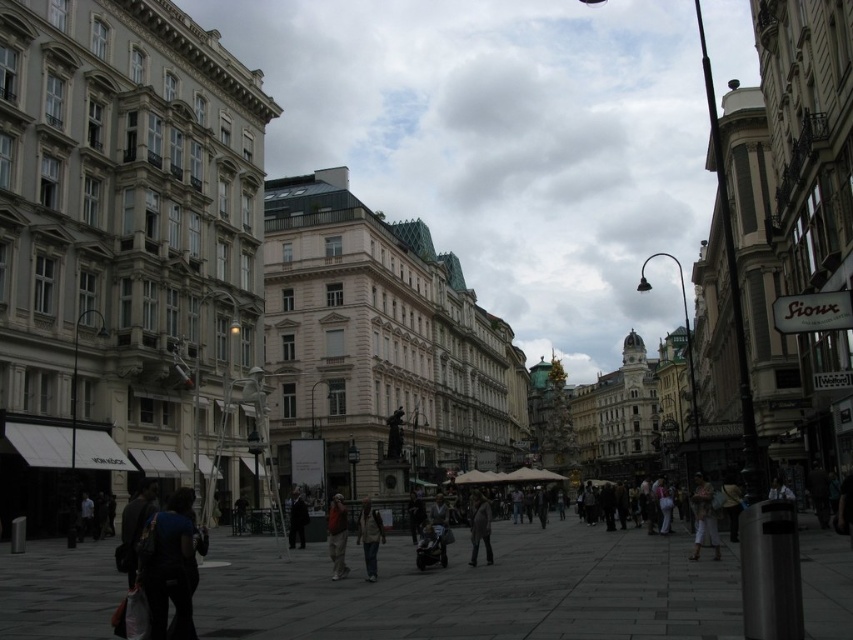
You are a photographer standing at the corner of the street in this urban scene. You want to take a photo of the khaki fabric jacket at center without any obstructions. Based on its position, where should you aim your camera?

The khaki fabric jacket at center is located at the 2D coordinates point (x=369, y=538), so you should aim your camera towards that point to capture it without obstructions.

You are standing in the middle of the street in this urban scene. You see the light pink fabric pants at lower right and a camera. Which object is closer to you?

The light pink fabric pants at lower right is closer to you since they are only 48.81 meters away from the camera, which is farther away.

You are a photographer standing in the middle of the street. You want to take a photo that includes both the khaki fabric jacket at center and the orange fabric pants at center. What is the minimum distance you need to move backward to ensure both subjects are fully visible in your frame?

The khaki fabric jacket at center is 6.46 feet from the orange fabric pants at center. To capture both in the frame, you need to move back at least 6.46 feet to ensure both are fully visible.